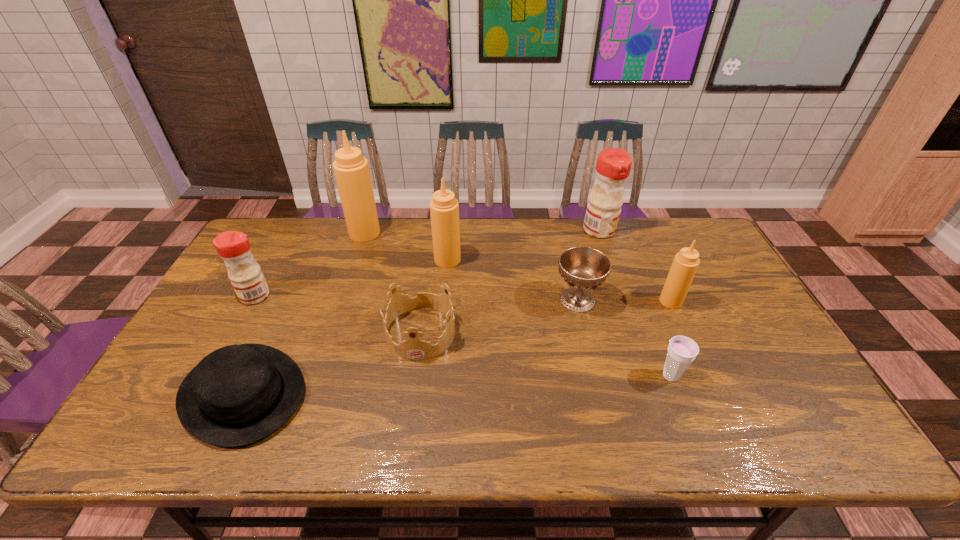
The image size is (960, 540). What are the coordinates of `free space between the nearer red condiment and the tiara` in the screenshot? It's located at (338, 314).

Locate which object is the second closest to the bigger red condiment. Please provide its 2D coordinates. Your answer should be formatted as a tuple, i.e. [(x, y)], where the tuple contains the x and y coordinates of a point satisfying the conditions above.

[(685, 264)]

At what (x,y) coordinates should I click in order to perform the action: click on object that is the fifth closest to the fourth condiment from right to left. Please return your answer as a coordinate pair (x, y). Looking at the image, I should click on (583, 268).

In order to click on condiment object that ranks as the fifth closest to the tiara in this screenshot , I will do `click(685, 264)`.

Locate which condiment is the closest to the shortest object. Please provide its 2D coordinates. Your answer should be formatted as a tuple, i.e. [(x, y)], where the tuple contains the x and y coordinates of a point satisfying the conditions above.

[(248, 281)]

Identify which tan condiment is located as the nearest to the rightmost object. Please provide its 2D coordinates. Your answer should be formatted as a tuple, i.e. [(x, y)], where the tuple contains the x and y coordinates of a point satisfying the conditions above.

[(444, 208)]

You are a GUI agent. You are given a task and a screenshot of the screen. Output one action in this format:
    pyautogui.click(x=<x>, y=<y>)
    Task: Click on the second closest tan condiment to the second smallest tan condiment
    This screenshot has height=540, width=960.
    Given the screenshot: What is the action you would take?
    pyautogui.click(x=685, y=264)